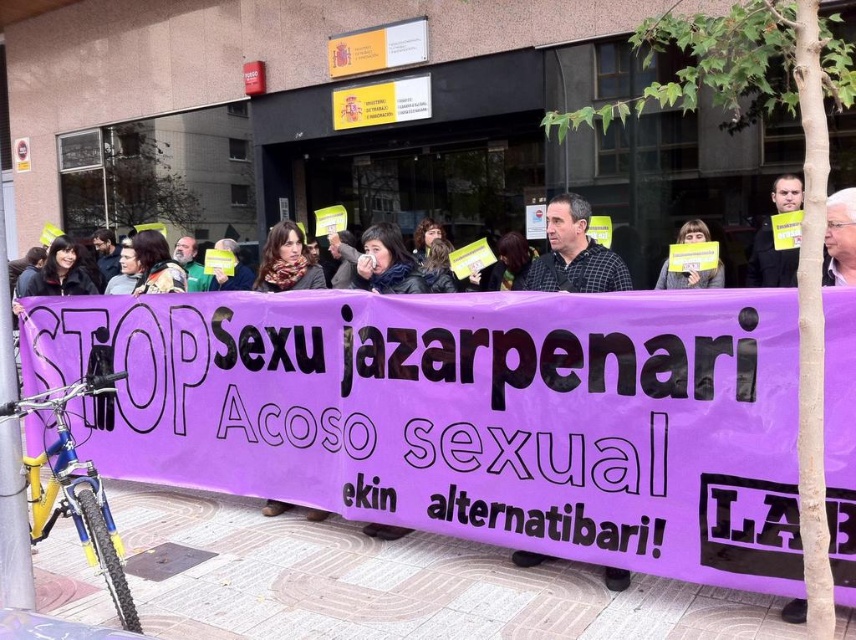
Question: Which point is farther to the camera?

Choices:
 (A) (544, 557)
 (B) (282, 506)

Answer: (B)

Question: Which object is positioned closest to the matte black shirt at center?

Choices:
 (A) purple fabric banner at center
 (B) yellow paper sign at center
 (C) purple fabric at center

Answer: (B)

Question: Can you confirm if purple fabric at center is wider than yellow paper sign at center?

Choices:
 (A) yes
 (B) no

Answer: (A)

Question: Does purple fabric at center appear on the left side of matte black shirt at center?

Choices:
 (A) no
 (B) yes

Answer: (B)

Question: Where is checkered fabric shirt at center located in relation to purple scarf at center in the image?

Choices:
 (A) left
 (B) right

Answer: (B)

Question: Which is farther from the purple fabric at center?

Choices:
 (A) purple scarf at center
 (B) checkered fabric shirt at center
 (C) yellow paper sign at center
 (D) purple fabric banner at center

Answer: (C)